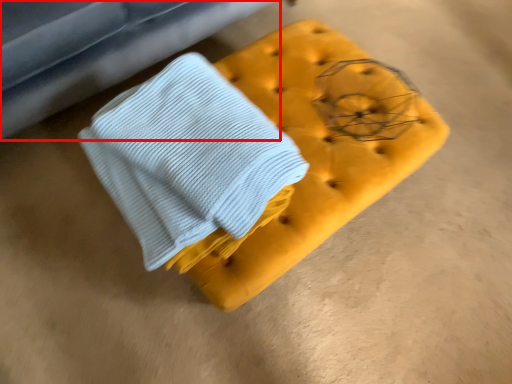
Question: From the image's perspective, considering the relative positions of furniture (annotated by the red box) and furniture in the image provided, where is furniture (annotated by the red box) located with respect to the staircase?

Choices:
 (A) above
 (B) below

Answer: (A)